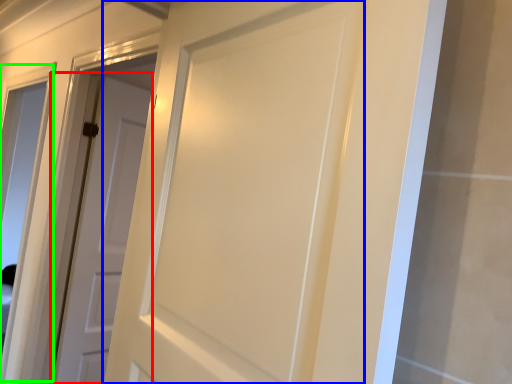
Question: Based on their relative distances, which object is farther from door (highlighted by a red box)? Choose from door (highlighted by a blue box) and window (highlighted by a green box).

Choices:
 (A) door
 (B) window

Answer: (B)